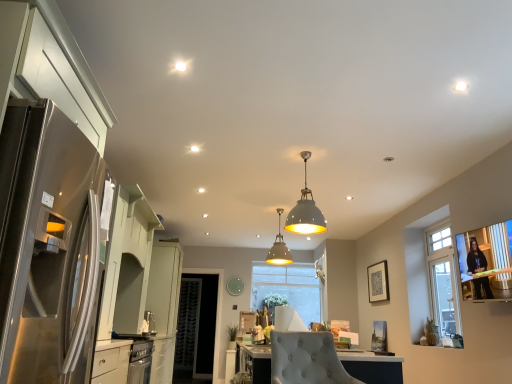
Question: From the image's perspective, is glass window screen at right located beneath clear glass door at center?

Choices:
 (A) yes
 (B) no

Answer: (B)

Question: Considering the relative sizes of glass window screen at right and clear glass door at center in the image provided, is glass window screen at right wider than clear glass door at center?

Choices:
 (A) no
 (B) yes

Answer: (B)

Question: Is glass window screen at right at the left side of clear glass door at center?

Choices:
 (A) no
 (B) yes

Answer: (A)

Question: Is clear glass door at center completely or partially inside glass window screen at right?

Choices:
 (A) no
 (B) yes

Answer: (A)

Question: Is glass window screen at right aimed at clear glass door at center?

Choices:
 (A) yes
 (B) no

Answer: (B)

Question: Considering the relative sizes of glass window screen at right and clear glass door at center in the image provided, is glass window screen at right taller than clear glass door at center?

Choices:
 (A) yes
 (B) no

Answer: (B)

Question: From the image's perspective, is glass window screen at right on satin nickel faucet at lower left?

Choices:
 (A) no
 (B) yes

Answer: (B)

Question: From a real-world perspective, is glass window screen at right over satin nickel faucet at lower left?

Choices:
 (A) yes
 (B) no

Answer: (A)

Question: Is glass window screen at right aimed at satin nickel faucet at lower left?

Choices:
 (A) yes
 (B) no

Answer: (B)

Question: Is glass window screen at right positioned in front of satin nickel faucet at lower left?

Choices:
 (A) no
 (B) yes

Answer: (B)

Question: Is satin nickel faucet at lower left at the back of glass window screen at right?

Choices:
 (A) yes
 (B) no

Answer: (B)

Question: Does glass window screen at right have a smaller size compared to satin nickel faucet at lower left?

Choices:
 (A) yes
 (B) no

Answer: (B)

Question: Is matte gray pendant light at center, the 1th lamp from the bottom, located outside stainless steel refrigerator at left?

Choices:
 (A) yes
 (B) no

Answer: (A)